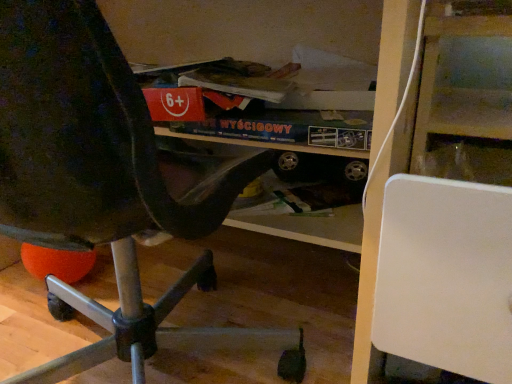
Question: In the image, is matte black chair at left positioned in front of or behind white matte board at right?

Choices:
 (A) front
 (B) behind

Answer: (A)

Question: From a real-world perspective, is matte black chair at left above or below white matte board at right?

Choices:
 (A) below
 (B) above

Answer: (B)

Question: In terms of width, does matte black chair at left look wider or thinner when compared to white matte board at right?

Choices:
 (A) thin
 (B) wide

Answer: (B)

Question: From a real-world perspective, is white matte board at right physically located above or below matte black chair at left?

Choices:
 (A) below
 (B) above

Answer: (A)

Question: Is point (406, 240) closer or farther from the camera than point (46, 64)?

Choices:
 (A) closer
 (B) farther

Answer: (B)

Question: Looking at their shapes, would you say white matte board at right is wider or thinner than matte black chair at left?

Choices:
 (A) wide
 (B) thin

Answer: (B)

Question: From the image's perspective, is white matte board at right above or below matte black chair at left?

Choices:
 (A) below
 (B) above

Answer: (A)